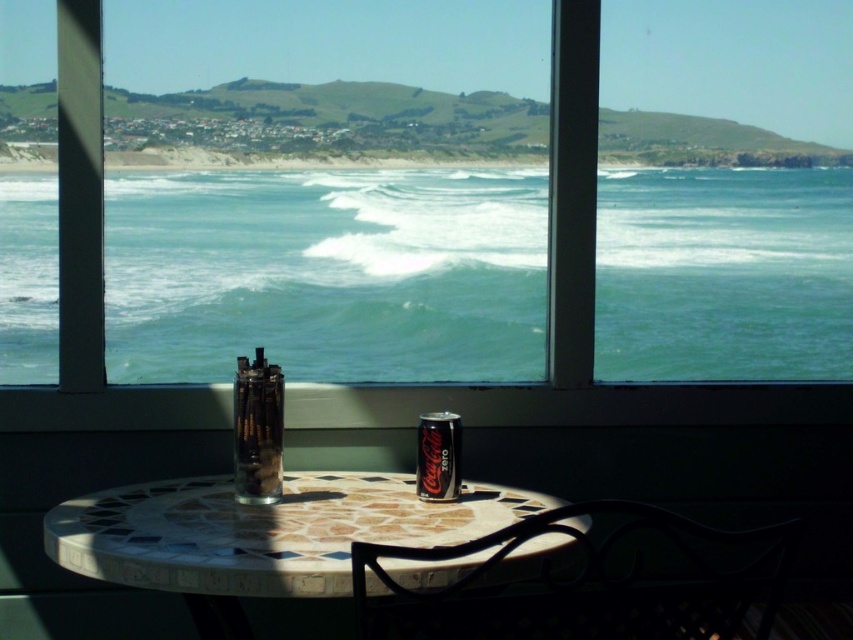
Question: Is clear glass at center smaller than metallic silver can at center?

Choices:
 (A) yes
 (B) no

Answer: (B)

Question: Which point is farther to the camera?

Choices:
 (A) mosaic tile table at center
 (B) greenish-blue water at center
 (C) clear glass at center

Answer: (B)

Question: Which of the following is the farthest from the observer?

Choices:
 (A) metallic silver can at center
 (B) metallic black chair at lower center
 (C) greenish-blue water at center
 (D) mosaic tile table at center

Answer: (C)

Question: From the image, what is the correct spatial relationship of metallic black chair at lower right in relation to clear glass at center?

Choices:
 (A) right
 (B) left

Answer: (A)

Question: Is greenish-blue water at center further to the viewer compared to metallic silver can at center?

Choices:
 (A) no
 (B) yes

Answer: (B)

Question: Which object is positioned farthest from the metallic silver can at center?

Choices:
 (A) clear glass at center
 (B) metallic black chair at lower right

Answer: (B)